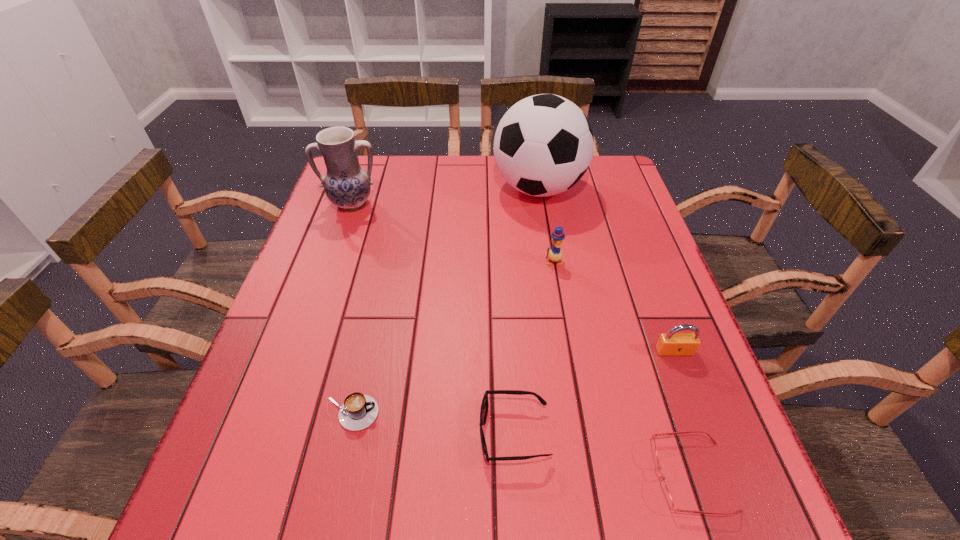
This screenshot has width=960, height=540. Identify the location of free spot that satisfies the following two spatial constraints: 1. to unlock the fourth nearest object from the front; 2. with the handle on the side of the cappuccino. (698, 414).